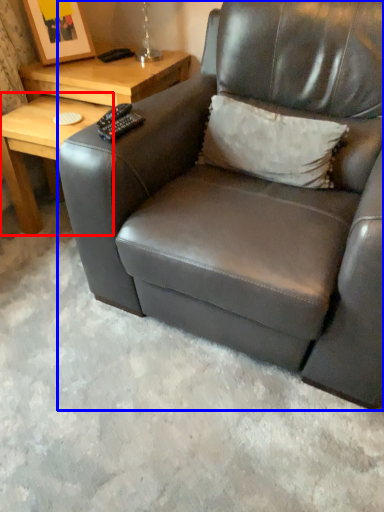
Question: Which of the following is the closest to the observer, table (highlighted by a red box) or chair (highlighted by a blue box)?

Choices:
 (A) table
 (B) chair

Answer: (B)